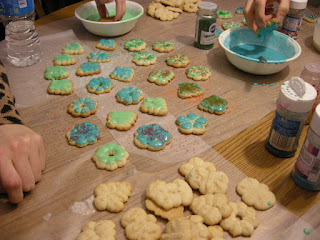
Where is `table`? This screenshot has height=240, width=320. table is located at coordinates (256, 166).